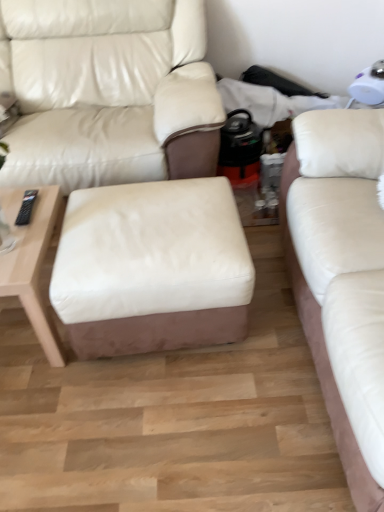
Question: Considering the relative sizes of white leather studio couch at center, arranged as the 1th studio couch when viewed from the left, and white leather ottoman at center in the image provided, is white leather studio couch at center, arranged as the 1th studio couch when viewed from the left, smaller than white leather ottoman at center?

Choices:
 (A) no
 (B) yes

Answer: (A)

Question: Can you confirm if white leather studio couch at center, acting as the second studio couch starting from the right, is wider than white leather ottoman at center?

Choices:
 (A) yes
 (B) no

Answer: (A)

Question: Is white leather studio couch at center, arranged as the 1th studio couch when viewed from the left, positioned with its back to white leather ottoman at center?

Choices:
 (A) no
 (B) yes

Answer: (A)

Question: Does white leather studio couch at center, arranged as the 1th studio couch when viewed from the left, have a lesser width compared to white leather ottoman at center?

Choices:
 (A) yes
 (B) no

Answer: (B)

Question: From the image's perspective, is white leather studio couch at center, acting as the second studio couch starting from the right, on white leather ottoman at center?

Choices:
 (A) no
 (B) yes

Answer: (B)

Question: Considering the positions of point (340, 285) and point (72, 339), is point (340, 285) closer or farther from the camera than point (72, 339)?

Choices:
 (A) farther
 (B) closer

Answer: (B)

Question: Visually, is white leather studio couch at right, arranged as the 2th studio couch when viewed from the left, positioned to the left or to the right of white leather ottoman at center?

Choices:
 (A) right
 (B) left

Answer: (A)

Question: Is white leather studio couch at right, arranged as the 2th studio couch when viewed from the left, wider or thinner than white leather ottoman at center?

Choices:
 (A) thin
 (B) wide

Answer: (B)

Question: Considering the positions of white leather studio couch at right, arranged as the 2th studio couch when viewed from the left, and white leather ottoman at center in the image, is white leather studio couch at right, arranged as the 2th studio couch when viewed from the left, taller or shorter than white leather ottoman at center?

Choices:
 (A) tall
 (B) short

Answer: (A)

Question: Considering the positions of light wood/woodentable at left and white leather ottoman at center in the image, is light wood/woodentable at left taller or shorter than white leather ottoman at center?

Choices:
 (A) short
 (B) tall

Answer: (A)

Question: Visually, is light wood/woodentable at left positioned to the left or to the right of white leather ottoman at center?

Choices:
 (A) right
 (B) left

Answer: (B)

Question: From the image's perspective, relative to white leather ottoman at center, is light wood/woodentable at left above or below?

Choices:
 (A) above
 (B) below

Answer: (B)

Question: Is light wood/woodentable at left in front of or behind white leather ottoman at center in the image?

Choices:
 (A) front
 (B) behind

Answer: (B)

Question: Considering the positions of white leather ottoman at center and light wood/woodentable at left in the image, is white leather ottoman at center taller or shorter than light wood/woodentable at left?

Choices:
 (A) short
 (B) tall

Answer: (B)

Question: Choose the correct answer: Is white leather ottoman at center inside light wood/woodentable at left or outside it?

Choices:
 (A) inside
 (B) outside

Answer: (B)